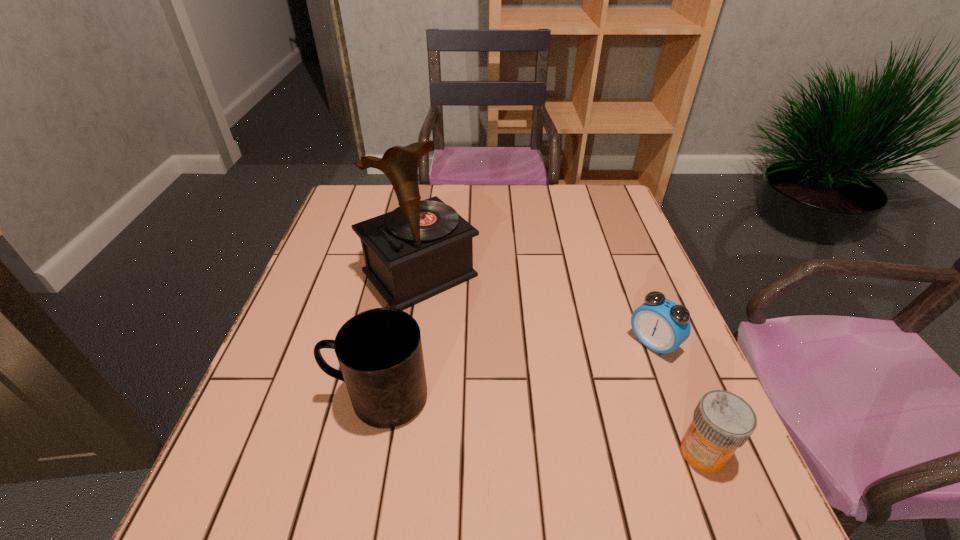
Find the location of a particular element. free spot on the desktop that is between the second tallest object and the medicine and is positioned on the face of the alarm clock is located at coordinates (555, 427).

The image size is (960, 540). I want to click on vacant space on the desktop that is between the mug and the medicine and is positioned at the horn opening of the phonograph_record, so click(x=564, y=429).